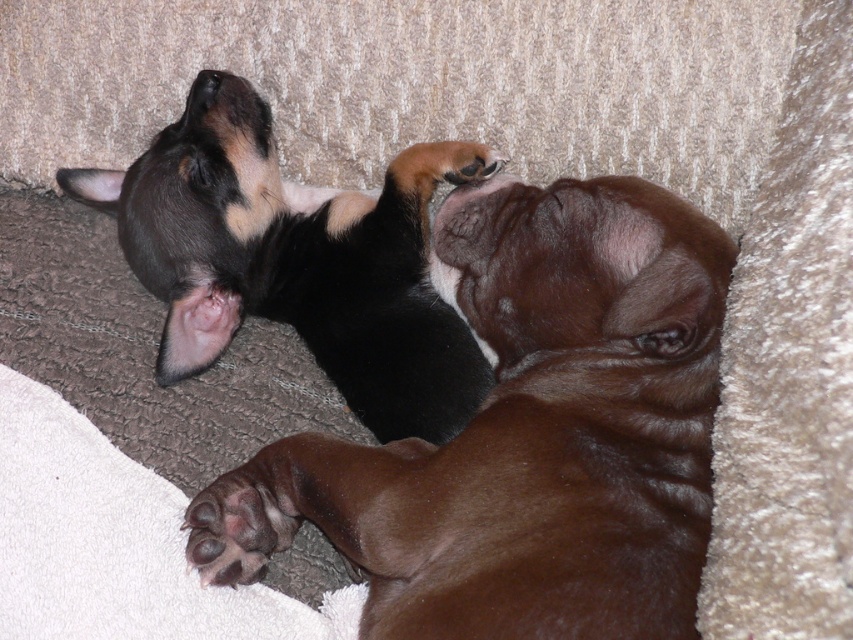
Question: Considering the relative positions of brown smooth dog at center and black matte dog at upper left in the image provided, where is brown smooth dog at center located with respect to black matte dog at upper left?

Choices:
 (A) right
 (B) left

Answer: (A)

Question: Does brown smooth dog at center appear on the left side of black matte dog at upper left?

Choices:
 (A) yes
 (B) no

Answer: (B)

Question: Which object appears farthest from the camera in this image?

Choices:
 (A) black matte dog at upper left
 (B) brown smooth dog at center

Answer: (A)

Question: Which object is farther from the camera taking this photo?

Choices:
 (A) black matte dog at upper left
 (B) brown smooth dog at center

Answer: (A)

Question: Which object is closer to the camera taking this photo?

Choices:
 (A) black matte dog at upper left
 (B) brown smooth dog at center

Answer: (B)

Question: Can you confirm if brown smooth dog at center is thinner than black matte dog at upper left?

Choices:
 (A) no
 (B) yes

Answer: (A)